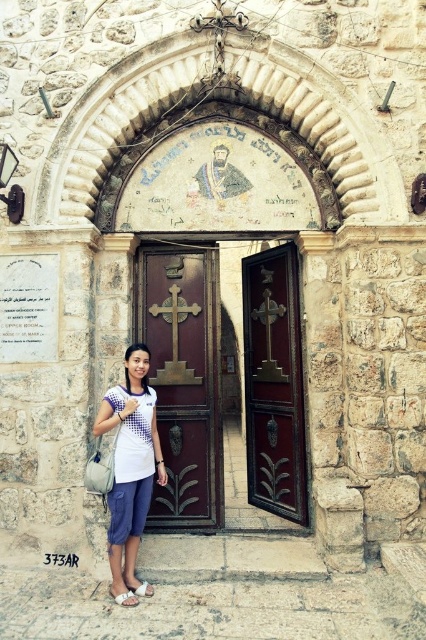
Does dark brown wood door at center appear over brown polished wood door at center?

Yes.

Between dark brown wood door at center and brown polished wood door at center, which one has less height?

Standing shorter between the two is dark brown wood door at center.

Does point (176, 381) come farther from viewer compared to point (192, 339)?

No, (176, 381) is closer to viewer.

Find the location of a particular element. The width and height of the screenshot is (426, 640). dark brown wood door at center is located at coordinates (186, 376).

Is brown polished wood door at center above dark wood door at center?

No.

Does point (149, 269) come closer to viewer compared to point (262, 490)?

Yes, point (149, 269) is closer to viewer.

Image resolution: width=426 pixels, height=640 pixels. Identify the location of brown polished wood door at center. (184, 380).

Consider the image. Between dark brown wood door at center and white cotton shirt at lower center, which one is positioned higher?

Positioned higher is dark brown wood door at center.

The height and width of the screenshot is (640, 426). Identify the location of dark brown wood door at center. (186, 376).

The width and height of the screenshot is (426, 640). Find the location of `dark brown wood door at center`. dark brown wood door at center is located at coordinates (186, 376).